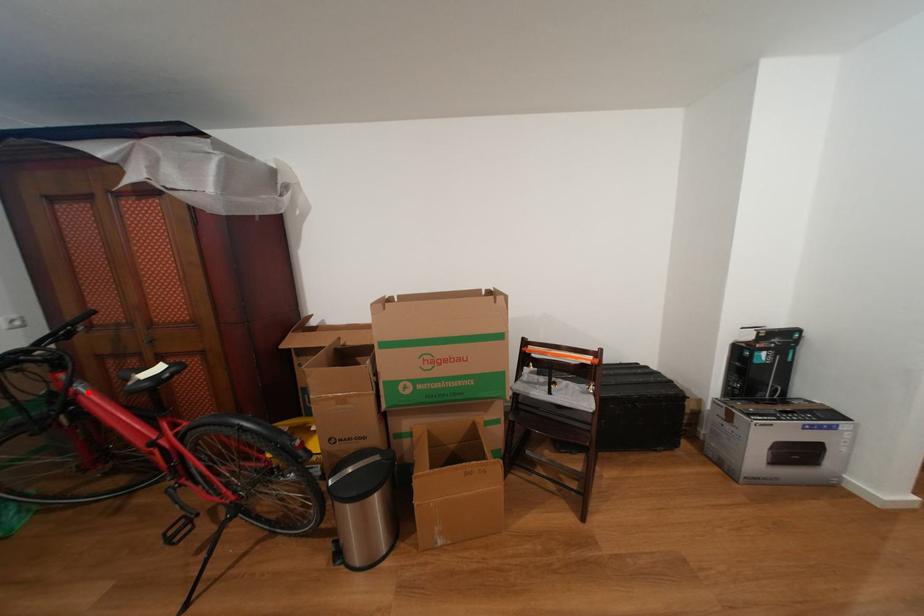
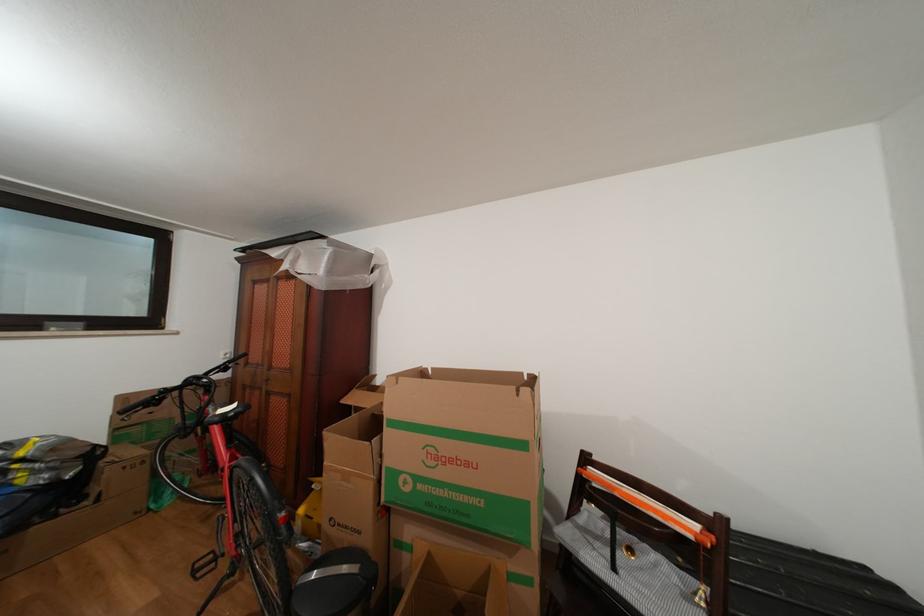
Question: I am providing you with two images of the same scene from different viewpoints. A red point is shown in image1. For the corresponding object point in image2, is it positioned nearer or farther from the camera?

Choices:
 (A) Nearer
 (B) Farther

Answer: (B)